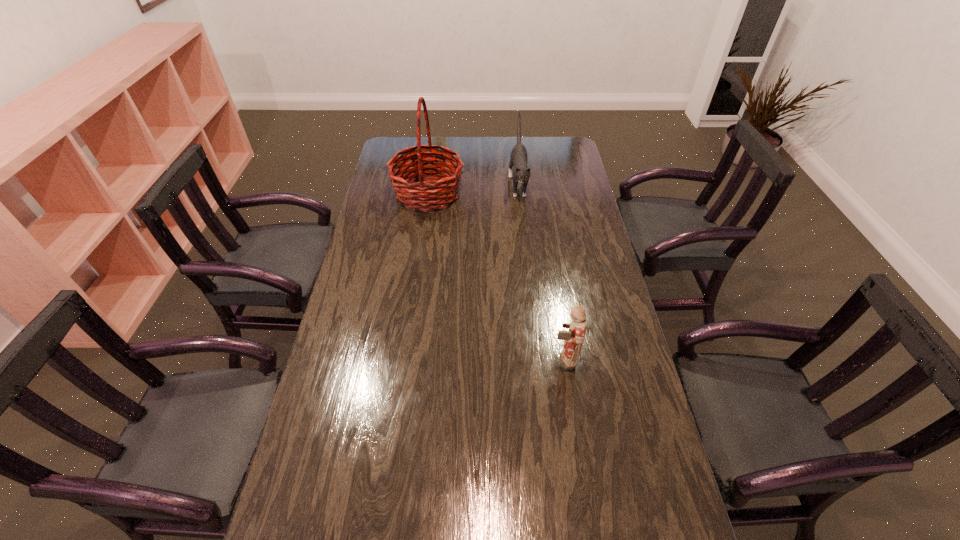
The image size is (960, 540). I want to click on object that is positioned at the left edge, so click(x=418, y=194).

This screenshot has height=540, width=960. Find the location of `object located at the right edge`. object located at the right edge is located at coordinates (574, 337).

At what (x,y) coordinates should I click in order to perform the action: click on free spot at the far edge of the desktop. Please return your answer as a coordinate pair (x, y). The width and height of the screenshot is (960, 540). Looking at the image, I should click on (451, 146).

At what (x,y) coordinates should I click in order to perform the action: click on free space at the left edge. Please return your answer as a coordinate pair (x, y). This screenshot has height=540, width=960. Looking at the image, I should click on (387, 305).

I want to click on vacant area at the right edge of the desktop, so click(x=629, y=359).

Identify the location of vacant space at the far right corner of the desktop. (563, 148).

You are a GUI agent. You are given a task and a screenshot of the screen. Output one action in this format:
    pyautogui.click(x=<x>, y=<y>)
    Task: Click on the empty space between the cat and the nearest object
    The image size is (960, 540).
    Given the screenshot: What is the action you would take?
    pyautogui.click(x=540, y=272)

Locate an element on the screen. vacant space that's between the cat and the nearest object is located at coordinates (540, 272).

In order to click on vacant region between the figurine and the cat in this screenshot , I will do `click(540, 272)`.

Where is `unoccupied area between the figurine and the leftmost object`? The height and width of the screenshot is (540, 960). unoccupied area between the figurine and the leftmost object is located at coordinates (495, 277).